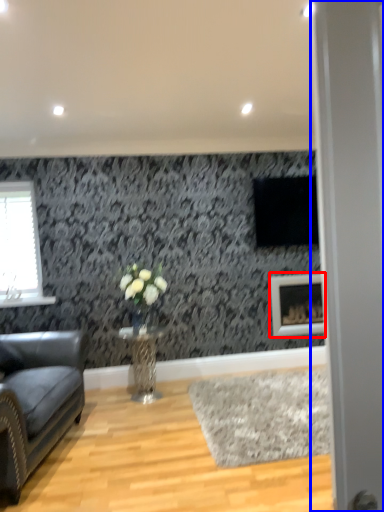
Question: Which object is closer to the camera taking this photo, picture frame (highlighted by a red box) or glass door (highlighted by a blue box)?

Choices:
 (A) picture frame
 (B) glass door

Answer: (B)